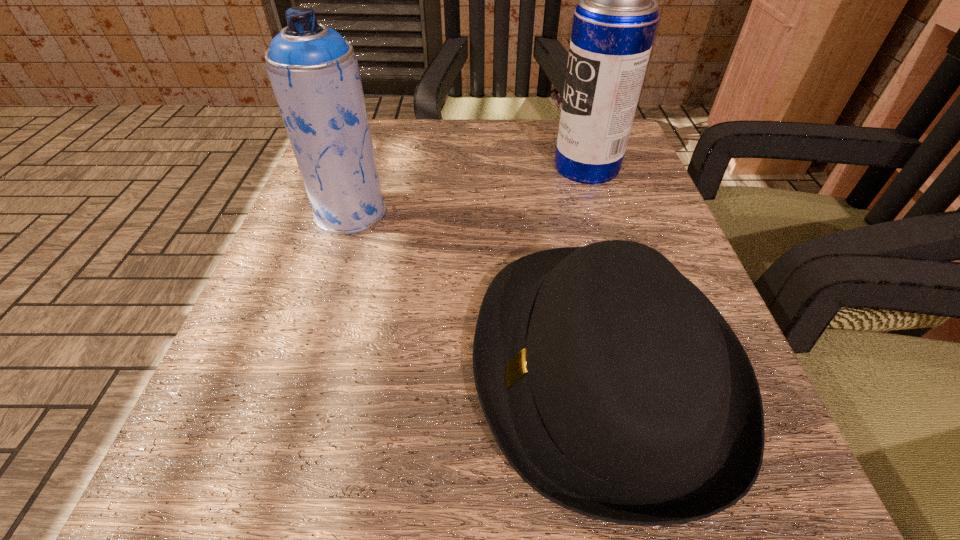
Locate an element on the screen. free space located 0.080m on the front-facing side of the shortest object is located at coordinates (409, 367).

Find the location of `free space located 0.310m on the front-facing side of the shortest object`. free space located 0.310m on the front-facing side of the shortest object is located at coordinates (226, 367).

Where is `blank area located 0.230m on the front-facing side of the shortest object`? The width and height of the screenshot is (960, 540). blank area located 0.230m on the front-facing side of the shortest object is located at coordinates (289, 367).

The image size is (960, 540). I want to click on object present at the far edge, so click(614, 25).

Locate an element on the screen. This screenshot has height=540, width=960. object positioned at the near edge is located at coordinates (613, 386).

The width and height of the screenshot is (960, 540). Identify the location of object present at the left edge. (313, 70).

Where is `aerosol can situated at the right edge`? The image size is (960, 540). aerosol can situated at the right edge is located at coordinates (614, 25).

Locate an element on the screen. fedora located in the right edge section of the desktop is located at coordinates (613, 386).

The height and width of the screenshot is (540, 960). I want to click on object located at the far right corner, so click(x=614, y=25).

Find the location of a particular element. The height and width of the screenshot is (540, 960). object situated at the near right corner is located at coordinates (613, 386).